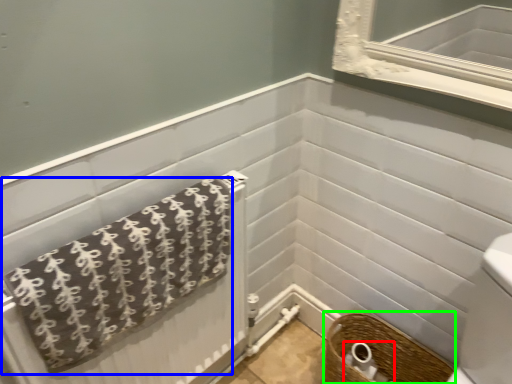
Question: Which is nearer to the toilet paper (highlighted by a red box)? towel (highlighted by a blue box) or basket (highlighted by a green box).

Choices:
 (A) towel
 (B) basket

Answer: (B)